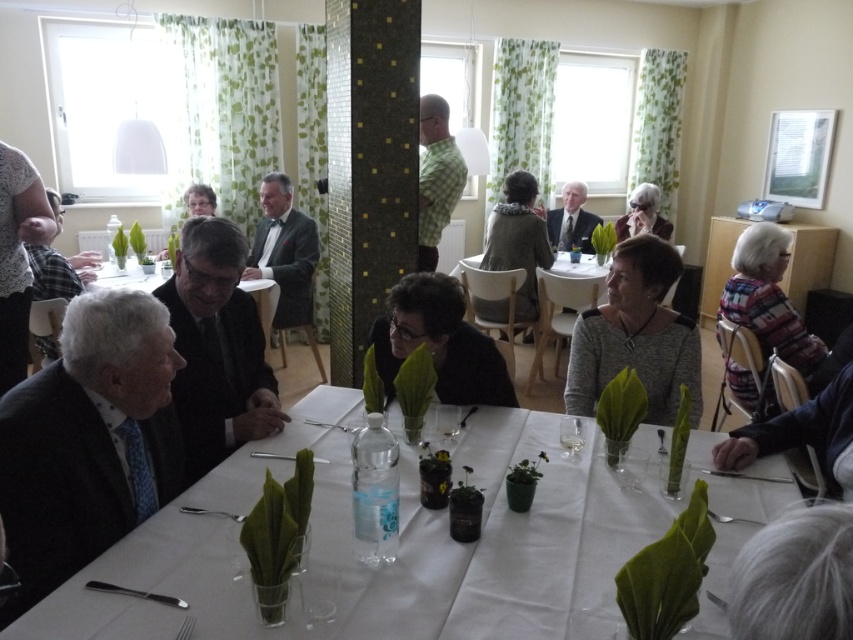
Can you confirm if gray hair at lower right is positioned to the left of green textured sweater at center?

Indeed, gray hair at lower right is positioned on the left side of green textured sweater at center.

Does gray hair at lower right have a greater width compared to green textured sweater at center?

Incorrect, gray hair at lower right's width does not surpass green textured sweater at center's.

Between point (776, 563) and point (486, 234), which one is positioned in front?

Positioned in front is point (776, 563).

The image size is (853, 640). Find the location of `gray hair at lower right`. gray hair at lower right is located at coordinates (795, 577).

Who is more forward, (42,484) or (299,243)?

Point (42,484) is in front.

This screenshot has width=853, height=640. What do you see at coordinates (88, 440) in the screenshot?
I see `dark gray suit at left` at bounding box center [88, 440].

Is point (141, 371) positioned after point (293, 307)?

No, it is not.

Locate an element on the screen. Image resolution: width=853 pixels, height=640 pixels. dark gray suit at left is located at coordinates (88, 440).

Which of these two, matte black jacket at left or plaid fabric shirt at left, stands shorter?

Standing shorter between the two is matte black jacket at left.

Which is below, matte black jacket at left or plaid fabric shirt at left?

matte black jacket at left is lower down.

Which is in front, point (39, 236) or point (45, 264)?

Point (39, 236) is in front.

The width and height of the screenshot is (853, 640). I want to click on matte black jacket at left, so click(16, 257).